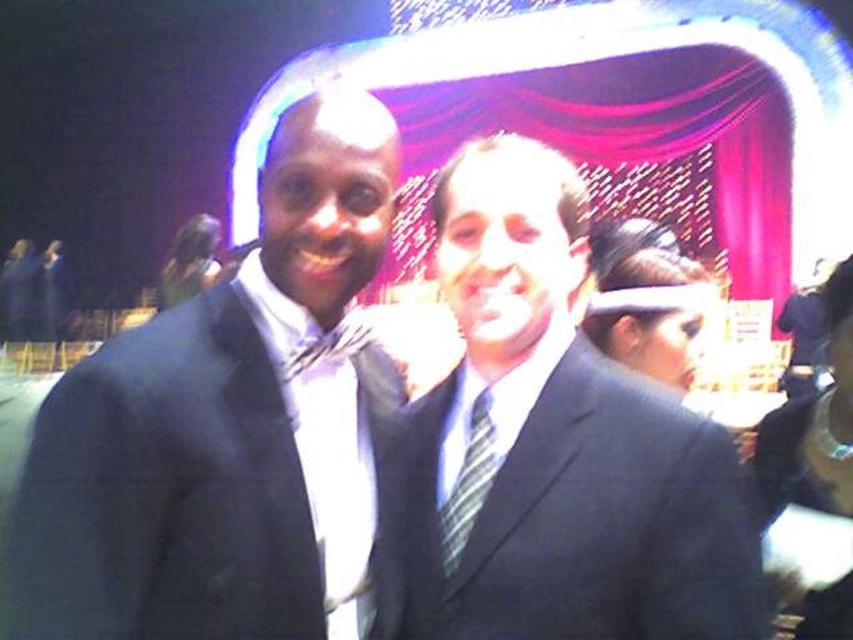
Is matte black suit at left positioned at the back of matte black suit at center?

No.

Is point (184, 513) farther from viewer compared to point (461, 515)?

No, it is in front of (461, 515).

This screenshot has width=853, height=640. In order to click on matte black suit at left in this screenshot , I will do (223, 429).

Does point (427, 458) lie in front of point (466, 540)?

No, (427, 458) is behind (466, 540).

Does matte black suit at center appear over striped fabric tie at center?

Indeed, matte black suit at center is positioned over striped fabric tie at center.

Is point (706, 532) farther from viewer compared to point (479, 451)?

That is False.

The width and height of the screenshot is (853, 640). Identify the location of matte black suit at center. (554, 445).

Is point (128, 333) behind point (457, 488)?

No, (128, 333) is in front of (457, 488).

Does matte black suit at left have a greater height compared to striped fabric tie at center?

Yes, matte black suit at left is taller than striped fabric tie at center.

Image resolution: width=853 pixels, height=640 pixels. What do you see at coordinates (223, 429) in the screenshot?
I see `matte black suit at left` at bounding box center [223, 429].

Identify the location of matte black suit at left. The height and width of the screenshot is (640, 853). (223, 429).